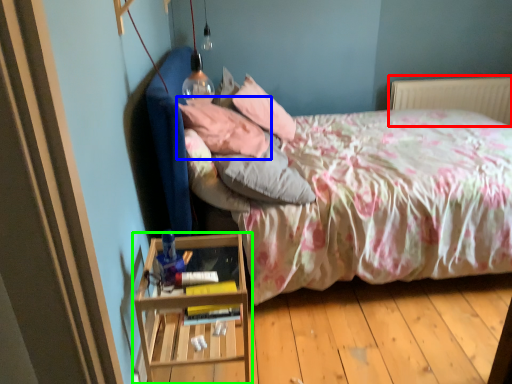
Question: Which is nearer to the radiator (highlighted by a red box)? pillow (highlighted by a blue box) or nightstand (highlighted by a green box).

Choices:
 (A) pillow
 (B) nightstand

Answer: (A)